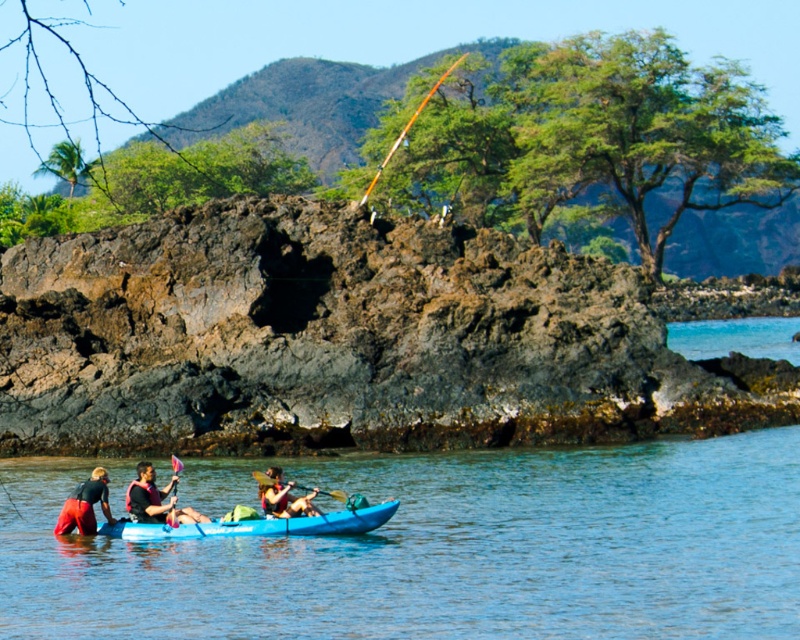
Question: Is red fabric kayak at lower left positioned behind yellow wood paddle at center?

Choices:
 (A) no
 (B) yes

Answer: (B)

Question: Can you confirm if blue smooth water at center is positioned to the right of red fabric kayak at lower left?

Choices:
 (A) yes
 (B) no

Answer: (A)

Question: Which of the following is the closest to the observer?

Choices:
 (A) (172, 481)
 (B) (336, 515)

Answer: (B)

Question: Which point is farther to the camera?

Choices:
 (A) blue plastic canoe at center
 (B) brushed metal paddle at lower left

Answer: (B)

Question: Based on their relative distances, which object is nearer to the blue smooth water at center?

Choices:
 (A) matte red kayak at lower center
 (B) brushed metal paddle at lower left
 (C) matte red kayak at center
 (D) red fabric kayak at lower left

Answer: (C)

Question: Observing the image, what is the correct spatial positioning of blue plastic canoe at center in reference to matte red kayak at lower center?

Choices:
 (A) left
 (B) right

Answer: (B)